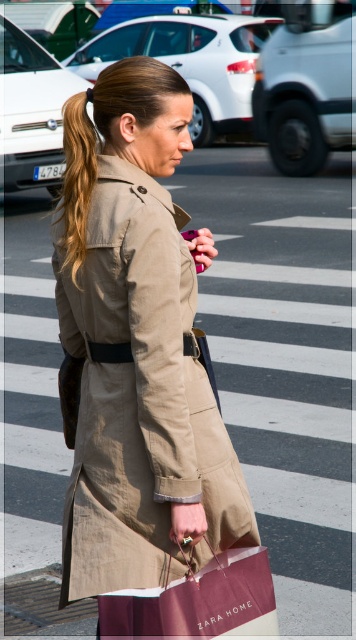
Question: Which point is closer to the camera?

Choices:
 (A) (66, 104)
 (B) (137, 294)

Answer: (B)

Question: Among these points, which one is nearest to the camera?

Choices:
 (A) (97, 83)
 (B) (275, 618)
 (C) (196, 419)

Answer: (B)

Question: Does tan fabric trench coat at center lie in front of light brown silky hair at upper left?

Choices:
 (A) yes
 (B) no

Answer: (A)

Question: Which point is farther from the camera taking this photo?

Choices:
 (A) (159, 356)
 (B) (96, 106)

Answer: (B)

Question: Is maroon paper bag at lower center smaller than light brown silky hair at upper left?

Choices:
 (A) yes
 (B) no

Answer: (B)

Question: Is tan fabric trench coat at center below maroon paper bag at lower center?

Choices:
 (A) no
 (B) yes

Answer: (A)